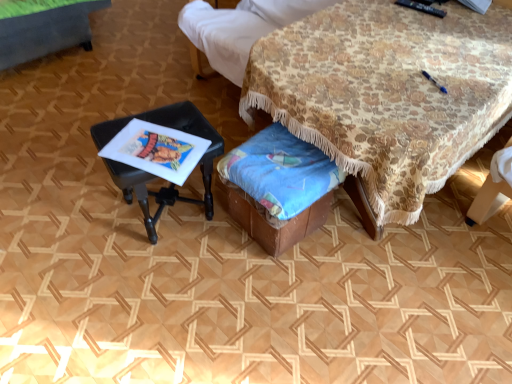
Question: Is floral fabric table at center, the 1th table from the right, wider or thinner than blue fabric at lower center?

Choices:
 (A) thin
 (B) wide

Answer: (B)

Question: In the image, is floral fabric table at center, marked as the 2th table in a left-to-right arrangement, on the left side or the right side of blue fabric at lower center?

Choices:
 (A) right
 (B) left

Answer: (A)

Question: Which object is positioned closest to the floral fabric table at center, the 1th table from the right?

Choices:
 (A) blue fabric at lower center
 (B) black plastic stool at left, arranged as the 1th table when viewed from the left

Answer: (A)

Question: Which object is positioned closest to the black plastic stool at left, placed as the 2th table when sorted from right to left?

Choices:
 (A) blue fabric at lower center
 (B) floral fabric table at center, the 1th table from the right

Answer: (A)